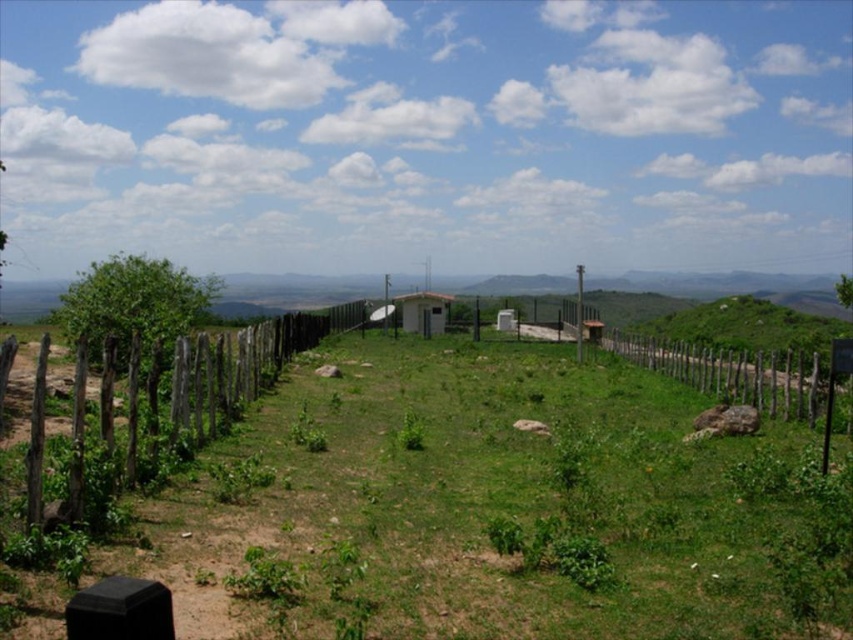
Is brown wooden fence at left taller than white matte hut at center?

No, brown wooden fence at left is not taller than white matte hut at center.

Consider the image. Does brown wooden fence at left appear on the left side of white matte hut at center?

Indeed, brown wooden fence at left is positioned on the left side of white matte hut at center.

Does point (155, 472) come closer to viewer compared to point (416, 326)?

Yes, point (155, 472) is closer to viewer.

What are the coordinates of `brown wooden fence at left` in the screenshot? It's located at (204, 385).

Is green grassy field at center thinner than brown wooden fence at left?

No, green grassy field at center is not thinner than brown wooden fence at left.

Is point (500, 404) positioned before point (247, 388)?

No, (500, 404) is further to viewer.

Where is `green grassy field at center`? Image resolution: width=853 pixels, height=640 pixels. green grassy field at center is located at coordinates (489, 506).

Does wooden fence at center appear under white matte hut at center?

Indeed, wooden fence at center is positioned under white matte hut at center.

Who is more forward, (825,394) or (424,294)?

Positioned in front is point (825,394).

What do you see at coordinates (734, 356) in the screenshot? The width and height of the screenshot is (853, 640). I see `wooden fence at center` at bounding box center [734, 356].

This screenshot has height=640, width=853. In order to click on wooden fence at center in this screenshot , I will do `click(734, 356)`.